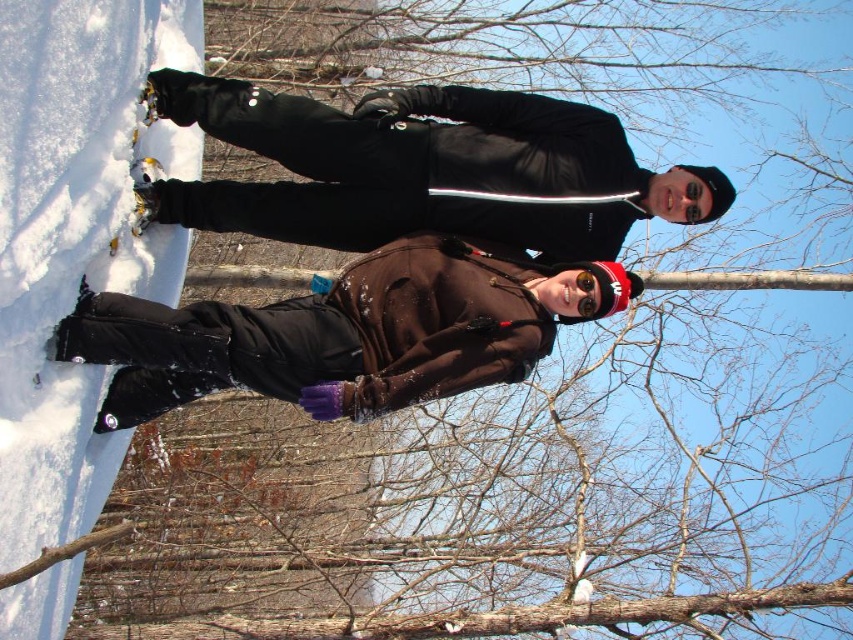
You are planning to take a winter photo with two people. The scene requires one person to stand behind the other. Given the positions of the black matte jacket at upper center and the brown matte jacket at center, which person should be placed in front to ensure the one behind is fully visible?

The brown matte jacket at center should be placed in front because the black matte jacket at upper center is taller, allowing the person behind to remain visible without being obscured.

You are a photographer trying to capture a photo of the black matte jacket at upper center. The camera you are using has a limited field of view. Based on the scene description, can you determine if the person in the brown jacket, black pants, and purple gloves is within the frame of the photo centered at point (426, 170)?

The point (426, 170) marks the black matte jacket at upper center. Since the photographer is centering the photo on this point, the person in the brown jacket, black pants, and purple gloves may or may not be in the frame depending on the camera angle and field of view. The scene description does not provide spatial information about their exact position relative to the point.

You are planning to take a photo of the two people in the snowy environment. You want to ensure both the black matte jacket at upper center and the brown matte jacket at center are clearly visible in the frame. Based on their positions, which jacket will appear higher in the photo?

The black matte jacket at upper center will appear higher in the photo because it is positioned above the brown matte jacket at center.